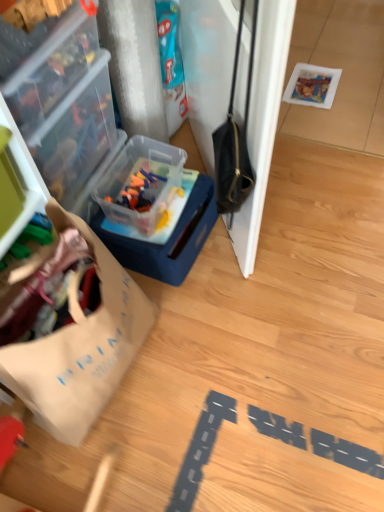
In order to face transparent plastic container at upper left, acting as the second box starting from the right, should I rotate leftwards or rightwards?

A 18.641 degree turn to the left will do.

This screenshot has height=512, width=384. What do you see at coordinates (70, 328) in the screenshot?
I see `brown paper bag at left` at bounding box center [70, 328].

I want to click on translucent plastic container at center-left, the 2th box from the left, so [154, 211].

Is translucent plastic container at center-left, which appears as the 1th box when viewed from the right, surrounding transparent plastic container at upper left, acting as the second box starting from the right?

Actually, transparent plastic container at upper left, acting as the second box starting from the right, is outside translucent plastic container at center-left, which appears as the 1th box when viewed from the right.

This screenshot has height=512, width=384. What are the coordinates of `box that appears above the translucent plastic container at center-left, which appears as the 1th box when viewed from the right (from the image's perspective)` in the screenshot? It's located at (77, 135).

Can you tell me how much translucent plastic container at center-left, the 2th box from the left, and transparent plastic container at upper left, marked as the 1th box in a left-to-right arrangement, differ in facing direction?

The facing directions of translucent plastic container at center-left, the 2th box from the left, and transparent plastic container at upper left, marked as the 1th box in a left-to-right arrangement, are 0.000411 degrees apart.

From the image's perspective, which one is positioned higher, translucent plastic container at center-left, the 2th box from the left, or transparent plastic container at upper left, marked as the 1th box in a left-to-right arrangement?

Result: transparent plastic container at upper left, marked as the 1th box in a left-to-right arrangement, is shown above in the image.

Is transparent plastic container at upper left, acting as the second box starting from the right, at the right side of translucent plastic container at center-left, which appears as the 1th box when viewed from the right?

No.

Is transparent plastic container at upper left, acting as the second box starting from the right, turned away from translucent plastic container at center-left, the 2th box from the left?

No, transparent plastic container at upper left, acting as the second box starting from the right, is not facing away from translucent plastic container at center-left, the 2th box from the left.

How much distance is there between transparent plastic container at upper left, marked as the 1th box in a left-to-right arrangement, and translucent plastic container at center-left, which appears as the 1th box when viewed from the right?

7.82 inches.

Looking at this image, is transparent plastic container at upper left, acting as the second box starting from the right, far away from translucent plastic container at center-left, which appears as the 1th box when viewed from the right?

Actually, transparent plastic container at upper left, acting as the second box starting from the right, and translucent plastic container at center-left, which appears as the 1th box when viewed from the right, are a little close together.

Can you confirm if transparent plastic container at upper left, acting as the second box starting from the right, is thinner than brown paper bag at left?

Indeed, transparent plastic container at upper left, acting as the second box starting from the right, has a lesser width compared to brown paper bag at left.

From their relative heights in the image, would you say transparent plastic container at upper left, marked as the 1th box in a left-to-right arrangement, is taller or shorter than brown paper bag at left?

transparent plastic container at upper left, marked as the 1th box in a left-to-right arrangement, is shorter than brown paper bag at left.

What's the angular difference between transparent plastic container at upper left, acting as the second box starting from the right, and brown paper bag at left's facing directions?

0.904 degrees.

How distant is transparent plastic container at upper left, acting as the second box starting from the right, from brown paper bag at left?

The distance of transparent plastic container at upper left, acting as the second box starting from the right, from brown paper bag at left is 13.26 inches.

Is the surface of brown paper bag at left in direct contact with transparent plastic container at upper left, acting as the second box starting from the right?

brown paper bag at left and transparent plastic container at upper left, acting as the second box starting from the right, are not in contact.

Considering the relative positions of brown paper bag at left and transparent plastic container at upper left, acting as the second box starting from the right, in the image provided, is brown paper bag at left to the left or to the right of transparent plastic container at upper left, acting as the second box starting from the right,?

From the image, it's evident that brown paper bag at left is to the right of transparent plastic container at upper left, acting as the second box starting from the right.

Which object is further away from the camera, brown paper bag at left or transparent plastic container at upper left, marked as the 1th box in a left-to-right arrangement?

transparent plastic container at upper left, marked as the 1th box in a left-to-right arrangement, is further from the camera.

You are a GUI agent. You are given a task and a screenshot of the screen. Output one action in this format:
    pyautogui.click(x=<x>, y=<y>)
    Task: Click on the wrapping paper in front of the transparent plastic container at upper left, marked as the 1th box in a left-to-right arrangement
    This screenshot has width=384, height=512.
    Given the screenshot: What is the action you would take?
    pyautogui.click(x=70, y=328)

Does brown paper bag at left turn towards translucent plastic container at center-left, the 2th box from the left?

No, brown paper bag at left is not facing towards translucent plastic container at center-left, the 2th box from the left.

Who is taller, brown paper bag at left or translucent plastic container at center-left, which appears as the 1th box when viewed from the right?

brown paper bag at left.

Is brown paper bag at left not close to translucent plastic container at center-left, which appears as the 1th box when viewed from the right?

No, brown paper bag at left is in close proximity to translucent plastic container at center-left, which appears as the 1th box when viewed from the right.

Based on the photo, which of these two, brown paper bag at left or translucent plastic container at center-left, the 2th box from the left, is thinner?

brown paper bag at left.

Which of these two, translucent plastic container at center-left, the 2th box from the left, or wooden floor at lower center, stands shorter?

wooden floor at lower center is shorter.

Is translucent plastic container at center-left, which appears as the 1th box when viewed from the right, facing away from wooden floor at lower center?

translucent plastic container at center-left, which appears as the 1th box when viewed from the right, does not have its back to wooden floor at lower center.

Does point (118, 158) appear closer or farther from the camera than point (292, 269)?

Clearly, point (118, 158) is more distant from the camera than point (292, 269).

From the image's perspective, relative to wooden floor at lower center, is translucent plastic container at center-left, which appears as the 1th box when viewed from the right, above or below?

translucent plastic container at center-left, which appears as the 1th box when viewed from the right, is above wooden floor at lower center.

This screenshot has height=512, width=384. Identify the location of wood that is in front of the translucent plastic container at center-left, which appears as the 1th box when viewed from the right. (250, 360).

From a real-world perspective, is wooden floor at lower center over translucent plastic container at center-left, which appears as the 1th box when viewed from the right?

Actually, wooden floor at lower center is physically below translucent plastic container at center-left, which appears as the 1th box when viewed from the right, in the real world.

Does wooden floor at lower center have a lesser height compared to translucent plastic container at center-left, which appears as the 1th box when viewed from the right?

Correct, wooden floor at lower center is not as tall as translucent plastic container at center-left, which appears as the 1th box when viewed from the right.

Is translucent plastic container at center-left, which appears as the 1th box when viewed from the right, a part of wooden floor at lower center?

That's incorrect, translucent plastic container at center-left, which appears as the 1th box when viewed from the right, is not inside wooden floor at lower center.

Where is `box above the translucent plastic container at center-left, the 2th box from the left (from the image's perspective)`? This screenshot has width=384, height=512. box above the translucent plastic container at center-left, the 2th box from the left (from the image's perspective) is located at coordinates (77, 135).

Identify the location of box that is in front of the translucent plastic container at center-left, which appears as the 1th box when viewed from the right. The height and width of the screenshot is (512, 384). (77, 135).

Looking at the image, which one is located further to translucent plastic container at center-left, the 2th box from the left, transparent plastic container at upper left, marked as the 1th box in a left-to-right arrangement, or brown paper bag at left?

Among the two, brown paper bag at left is located further to translucent plastic container at center-left, the 2th box from the left.

Looking at the image, which one is located further to transparent plastic container at upper left, marked as the 1th box in a left-to-right arrangement, translucent plastic container at center-left, which appears as the 1th box when viewed from the right, or wooden floor at lower center?

Among the two, wooden floor at lower center is located further to transparent plastic container at upper left, marked as the 1th box in a left-to-right arrangement.

Considering their positions, is transparent plastic container at upper left, marked as the 1th box in a left-to-right arrangement, positioned closer to wooden floor at lower center than brown paper bag at left?

Based on the image, brown paper bag at left appears to be nearer to wooden floor at lower center.

From the image, which object appears to be farther from wooden floor at lower center, translucent plastic container at center-left, which appears as the 1th box when viewed from the right, or transparent plastic container at upper left, acting as the second box starting from the right?

transparent plastic container at upper left, acting as the second box starting from the right, is further to wooden floor at lower center.

In the scene shown: Considering their positions, is translucent plastic container at center-left, the 2th box from the left, positioned closer to brown paper bag at left than wooden floor at lower center?

Based on the image, wooden floor at lower center appears to be nearer to brown paper bag at left.

From the image, which object appears to be farther from brown paper bag at left, translucent plastic container at center-left, which appears as the 1th box when viewed from the right, or transparent plastic container at upper left, acting as the second box starting from the right?

The object further to brown paper bag at left is translucent plastic container at center-left, which appears as the 1th box when viewed from the right.

Looking at the image, which one is located further to transparent plastic container at upper left, marked as the 1th box in a left-to-right arrangement, translucent plastic container at center-left, which appears as the 1th box when viewed from the right, or brown paper bag at left?

brown paper bag at left is further to transparent plastic container at upper left, marked as the 1th box in a left-to-right arrangement.

Estimate the real-world distances between objects in this image. Which object is further from wooden floor at lower center, brown paper bag at left or translucent plastic container at center-left, which appears as the 1th box when viewed from the right?

brown paper bag at left is further to wooden floor at lower center.

What are the coordinates of `wood between transparent plastic container at upper left, acting as the second box starting from the right, and brown paper bag at left, in the vertical direction` in the screenshot? It's located at (250, 360).

I want to click on box situated between transparent plastic container at upper left, acting as the second box starting from the right, and wooden floor at lower center from left to right, so [154, 211].

The image size is (384, 512). What are the coordinates of `wood between brown paper bag at left and translucent plastic container at center-left, the 2th box from the left, along the z-axis` in the screenshot? It's located at (250, 360).

At what (x,y) coordinates should I click in order to perform the action: click on box positioned between brown paper bag at left and translucent plastic container at center-left, the 2th box from the left, from near to far. Please return your answer as a coordinate pair (x, y). The image size is (384, 512). Looking at the image, I should click on (77, 135).